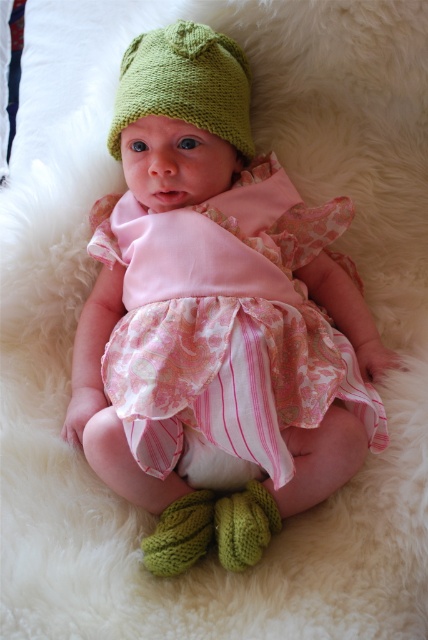
You are a photographer setting up for a baby photoshoot. The baby is wearing a pink floral fabric dress at center and a green knitted hat at upper center. You need to position a small prop between them. What is the minimum distance you should keep between the prop and each object to ensure it fits perfectly?

The minimum distance between the prop and each object should be at least half of the total distance between the pink floral fabric dress at center and the green knitted hat at upper center. Since they are 25.17 centimeters apart, placing the prop 12.59 centimeters from each would center it perfectly.

You are a photographer setting up for a baby photoshoot. You have to ensure that the pink floral fabric dress at center and the green knitted hat at upper center are both visible in the frame. Based on their positions, which object is lower in the image?

The pink floral fabric dress at center is positioned under the green knitted hat at upper center, so the dress is lower in the image.